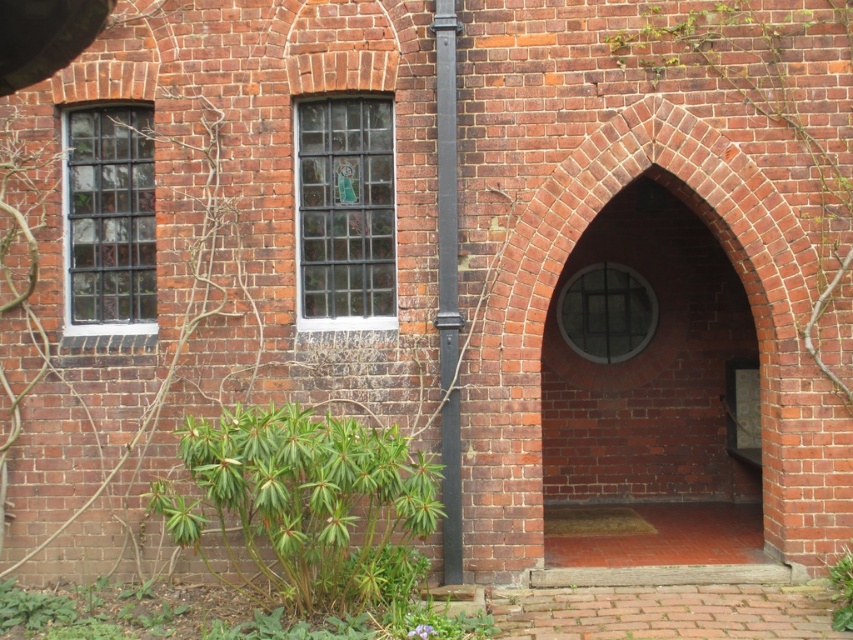
You are standing at the point closest to the viewer in the image. Which point, point [582,371] or point [451,164], is farther away from you?

Point [582,371] is farther away from you because it is behind point [451,164].

You are standing in front of a brick building and see a smooth black pole at center and a green leafy plant at lower right. Which object is closer to your left side?

The smooth black pole at center is positioned on the left side of green leafy plant at lower right, so it is closer to your left side.

You are an architect visiting this historical building and want to take a photo of the smooth brick archway at center and the green leafy plant at lower right. Which object should you focus on first if you want to capture both in the frame without moving the camera?

You should focus on the smooth brick archway at center first because it is larger than the green leafy plant at lower right, so it will take up more space in the frame and ensure proper composition.